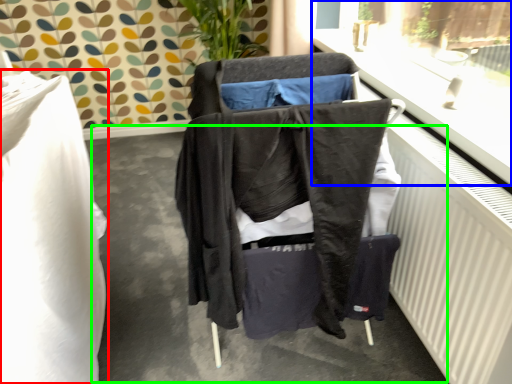
Question: Based on their relative distances, which object is farther from furniture (highlighted by a red box)? Choose from window frame (highlighted by a blue box) and concrete (highlighted by a green box).

Choices:
 (A) window frame
 (B) concrete

Answer: (A)